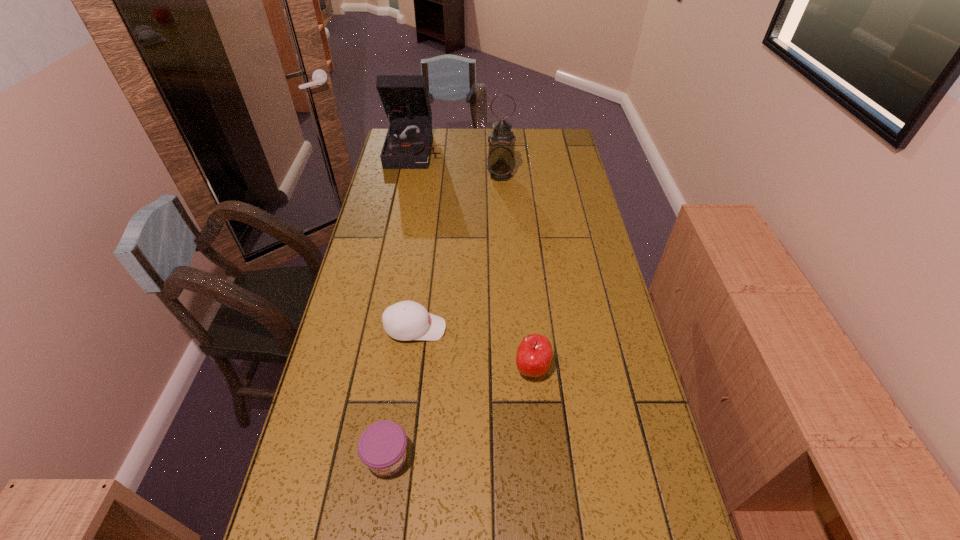
The image size is (960, 540). I want to click on object at the far edge, so click(405, 99).

This screenshot has height=540, width=960. In order to click on phonograph_record positioned at the left edge in this screenshot , I will do `click(405, 99)`.

This screenshot has width=960, height=540. What are the coordinates of `baseball cap present at the left edge` in the screenshot? It's located at coord(406,320).

Locate an element on the screen. jam that is positioned at the left edge is located at coordinates (382, 446).

Identify the location of object that is at the far left corner. (405, 99).

Find the location of a particular element. This screenshot has width=960, height=540. vacant area at the far edge of the desktop is located at coordinates (466, 144).

In the image, there is a desktop. Where is `free space at the left edge`? This screenshot has width=960, height=540. free space at the left edge is located at coordinates (377, 382).

In the image, there is a desktop. At what (x,y) coordinates should I click in order to perform the action: click on free space at the right edge. Please return your answer as a coordinate pair (x, y). This screenshot has height=540, width=960. Looking at the image, I should click on (550, 161).

Find the location of a particular element. vacant region at the far right corner of the desktop is located at coordinates (564, 128).

Locate an element on the screen. The height and width of the screenshot is (540, 960). vacant area that lies between the nearest object and the third tallest object is located at coordinates (460, 414).